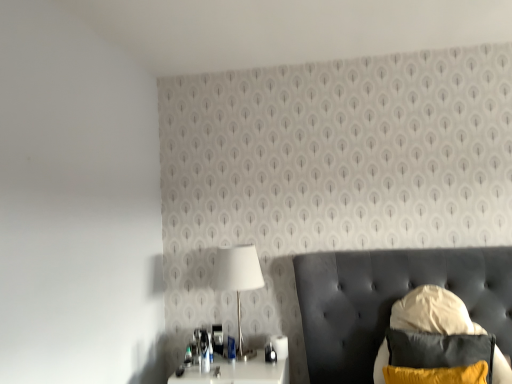
At what (x,y) coordinates should I click in order to perform the action: click on velvet black swivel chair at lower right. Please return your answer as a coordinate pair (x, y). The width and height of the screenshot is (512, 384). Looking at the image, I should click on (433, 313).

Describe the element at coordinates (433, 313) in the screenshot. The image size is (512, 384). I see `velvet black swivel chair at lower right` at that location.

Describe the element at coordinates (438, 358) in the screenshot. I see `velvet yellow pillow at lower right` at that location.

Measure the distance between point (454,341) and camera.

A distance of 2.14 meters exists between point (454,341) and camera.

Locate an element on the screen. The height and width of the screenshot is (384, 512). white glossy nightstand at lower center is located at coordinates (237, 372).

Choose the correct answer: Is white glossy nightstand at lower center inside white glossy lamp at center or outside it?

white glossy nightstand at lower center lies outside white glossy lamp at center.

Is the depth of white glossy nightstand at lower center greater than that of white glossy lamp at center?

No, white glossy nightstand at lower center is in front of white glossy lamp at center.

Is white glossy nightstand at lower center not near white glossy lamp at center?

white glossy nightstand at lower center is actually quite close to white glossy lamp at center.

From a real-world perspective, between white glossy nightstand at lower center and white glossy lamp at center, who is vertically lower?

white glossy nightstand at lower center.

Is velvet yellow pillow at lower right completely or partially outside of white glossy table at lower left?

No.

Locate an element on the screen. Image resolution: width=512 pixels, height=384 pixels. pillow below the white glossy table at lower left (from the image's perspective) is located at coordinates (438, 358).

From a real-world perspective, is velvet yellow pillow at lower right physically located above or below white glossy table at lower left?

velvet yellow pillow at lower right is below white glossy table at lower left.

Is white glossy lamp at center positioned with its back to velvet yellow pillow at lower right?

No.

Is white glossy lamp at center not near velvet yellow pillow at lower right?

white glossy lamp at center is positioned a significant distance from velvet yellow pillow at lower right.

From the image's perspective, relative to velvet yellow pillow at lower right, is white glossy lamp at center above or below?

Clearly, from the image's perspective, white glossy lamp at center is above velvet yellow pillow at lower right.

Can you confirm if white glossy lamp at center is bigger than velvet yellow pillow at lower right?

Yes, white glossy lamp at center is bigger than velvet yellow pillow at lower right.

The width and height of the screenshot is (512, 384). What are the coordinates of `furniture above the velvet yellow pillow at lower right (from the image's perspective)` in the screenshot? It's located at (390, 301).

Considering the points (316, 275) and (489, 340), which point is in front, point (316, 275) or point (489, 340)?

The point (489, 340) is in front.

Which object is thinner, white glossy table at lower left or velvet yellow pillow at lower right?

Thinner between the two is velvet yellow pillow at lower right.

Is white glossy table at lower left facing towards velvet yellow pillow at lower right?

No, white glossy table at lower left is not turned towards velvet yellow pillow at lower right.

Between point (318, 311) and point (218, 366), which one is positioned behind?

The point (318, 311) is behind.

Is white glossy table at lower left inside the boundaries of white glossy nightstand at lower center, or outside?

white glossy table at lower left cannot be found inside white glossy nightstand at lower center.

Looking at their sizes, would you say white glossy table at lower left is wider or thinner than white glossy nightstand at lower center?

Clearly, white glossy table at lower left has more width compared to white glossy nightstand at lower center.

From a real-world perspective, is white glossy table at lower left physically above white glossy nightstand at lower center?

Yes, from a real-world perspective, white glossy table at lower left is on top of white glossy nightstand at lower center.

Considering the relative positions of white glossy nightstand at lower center and white glossy table at lower left in the image provided, is white glossy nightstand at lower center behind white glossy table at lower left?

Yes, the depth of white glossy nightstand at lower center is greater than that of white glossy table at lower left.

Is white glossy nightstand at lower center thinner than white glossy table at lower left?

Yes, white glossy nightstand at lower center is thinner than white glossy table at lower left.

Is white glossy nightstand at lower center positioned far away from white glossy table at lower left?

No, white glossy nightstand at lower center is not far away from white glossy table at lower left.

Is white glossy nightstand at lower center completely or partially outside of white glossy table at lower left?

white glossy nightstand at lower center is positioned outside white glossy table at lower left.

Are white glossy lamp at center and white glossy nightstand at lower center beside each other?

white glossy lamp at center and white glossy nightstand at lower center are not in contact.

Looking at this image, based on their positions, is white glossy lamp at center located to the left or right of white glossy nightstand at lower center?

From the image, it's evident that white glossy lamp at center is to the right of white glossy nightstand at lower center.

Which is behind, white glossy lamp at center or white glossy nightstand at lower center?

white glossy lamp at center is further away from the camera.

Identify the location of lamp located above the white glossy nightstand at lower center (from a real-world perspective). This screenshot has height=384, width=512. (238, 274).

The height and width of the screenshot is (384, 512). In the image, there is a white glossy table at lower left. In order to click on pillow below it (from a real-world perspective) in this screenshot , I will do `click(438, 358)`.

Which object lies nearer to the anchor point white glossy nightstand at lower center, velvet black swivel chair at lower right or white glossy table at lower left?

Based on the image, white glossy table at lower left appears to be nearer to white glossy nightstand at lower center.

When comparing their distances from white glossy nightstand at lower center, does white glossy table at lower left or velvet yellow pillow at lower right seem closer?

white glossy table at lower left lies closer to white glossy nightstand at lower center than the other object.

Looking at the image, which one is located further to white glossy nightstand at lower center, white glossy table at lower left or white glossy lamp at center?

Among the two, white glossy table at lower left is located further to white glossy nightstand at lower center.

Considering their positions, is white glossy nightstand at lower center positioned further to velvet yellow pillow at lower right than velvet black swivel chair at lower right?

white glossy nightstand at lower center lies further to velvet yellow pillow at lower right than the other object.

Which object lies nearer to the anchor point white glossy lamp at center, velvet yellow pillow at lower right or white glossy table at lower left?

Among the two, white glossy table at lower left is located nearer to white glossy lamp at center.

Considering their positions, is white glossy lamp at center positioned closer to white glossy table at lower left than velvet black swivel chair at lower right?

The object closer to white glossy table at lower left is velvet black swivel chair at lower right.

Estimate the real-world distances between objects in this image. Which object is closer to white glossy table at lower left, white glossy lamp at center or white glossy nightstand at lower center?

Among the two, white glossy nightstand at lower center is located nearer to white glossy table at lower left.

From the image, which object appears to be nearer to velvet yellow pillow at lower right, velvet black swivel chair at lower right or white glossy lamp at center?

Based on the image, velvet black swivel chair at lower right appears to be nearer to velvet yellow pillow at lower right.

I want to click on swivel chair between white glossy table at lower left and white glossy lamp at center from front to back, so click(x=433, y=313).

Where is `lamp between white glossy nightstand at lower center and velvet black swivel chair at lower right in the horizontal direction`? lamp between white glossy nightstand at lower center and velvet black swivel chair at lower right in the horizontal direction is located at coordinates (238, 274).

Locate an element on the screen. pillow located between white glossy table at lower left and white glossy lamp at center in the depth direction is located at coordinates (438, 358).

Locate an element on the screen. The width and height of the screenshot is (512, 384). pillow positioned between white glossy table at lower left and velvet black swivel chair at lower right from near to far is located at coordinates (438, 358).